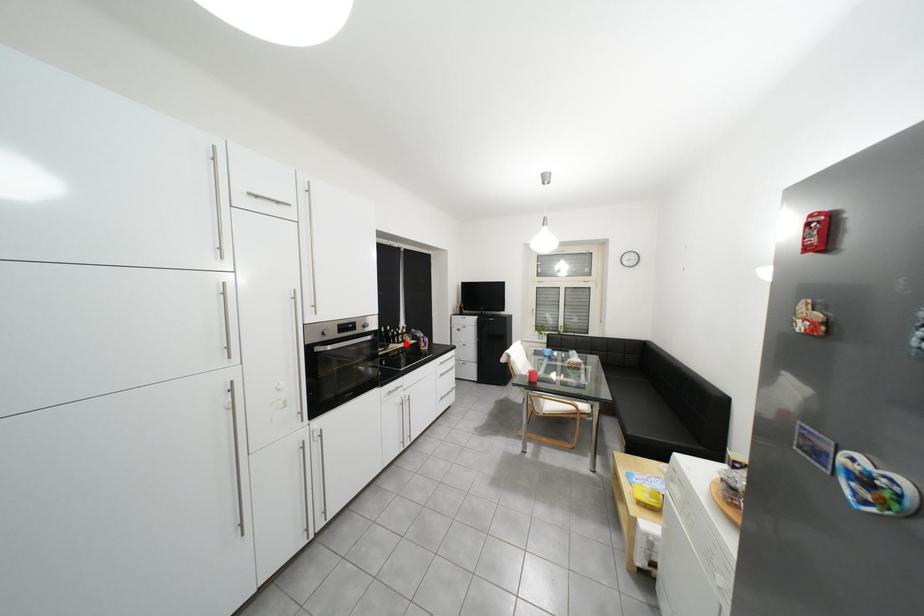
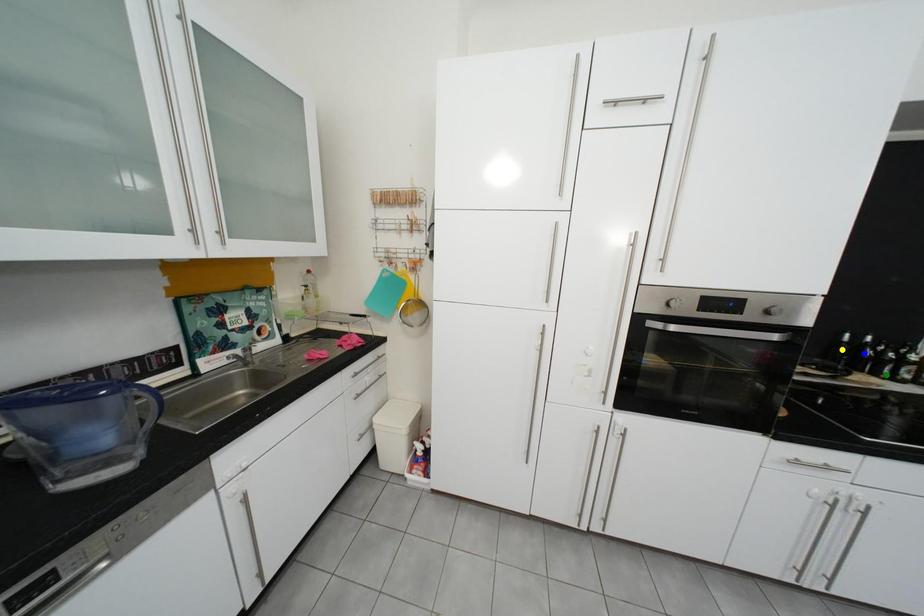
Question: I am providing you with two images of the same scene from different viewpoints. A red point is marked on the first image. You are given multiple points on the second image. Which spot in image 2 lines up with the point in image 1?

Choices:
 (A) yellow point
 (B) blue point
 (C) green point

Answer: (C)